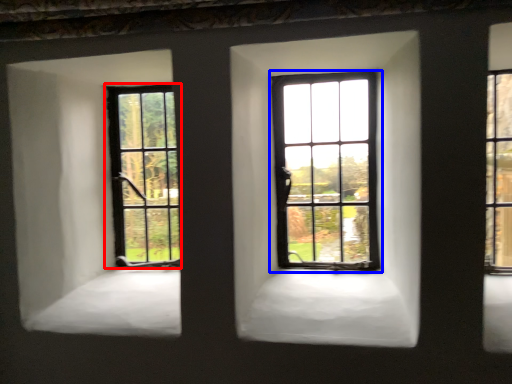
Question: Which point is closer to the camera, window (highlighted by a red box) or window (highlighted by a blue box)?

Choices:
 (A) window
 (B) window

Answer: (B)